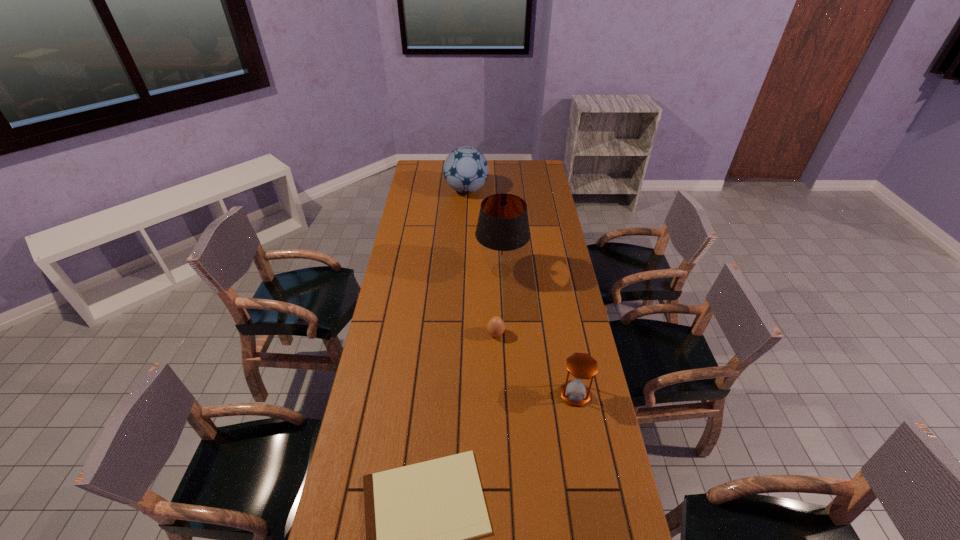
The width and height of the screenshot is (960, 540). I want to click on the second farthest object, so click(x=502, y=230).

Identify the location of the tallest object. (502, 230).

This screenshot has height=540, width=960. Identify the location of the fourth shortest object. (465, 169).

Locate an element on the screen. The width and height of the screenshot is (960, 540). soccer ball is located at coordinates (465, 169).

The width and height of the screenshot is (960, 540). I want to click on the rightmost object, so click(582, 366).

In order to click on the third tallest object in this screenshot , I will do `click(582, 366)`.

Locate an element on the screen. the third nearest object is located at coordinates (496, 326).

What are the coordinates of `boiled egg` in the screenshot? It's located at (496, 326).

Locate an element on the screen. vacant point located 0.380m on the back of the lampshade is located at coordinates (498, 208).

The height and width of the screenshot is (540, 960). Identify the location of free space located 0.210m on the side with brand of the soccer ball. (527, 190).